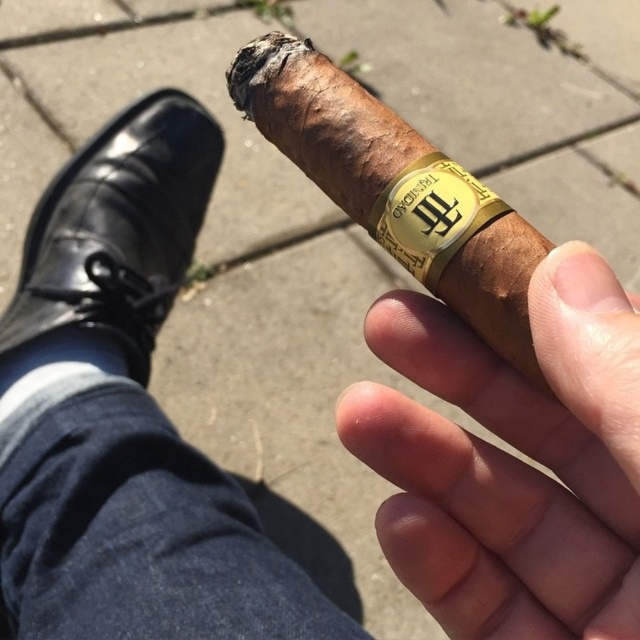
You are a photographer trying to capture the scene with the smooth skin at center and the black leather shoe at lower left. Which object should you focus on first if you want to ensure both are in focus, considering their distances from the camera?

The smooth skin at center is shorter than the black leather shoe at lower left, so you should focus on the black leather shoe at lower left first to ensure both are in focus.

You are a photographer trying to capture the details of the smooth skin at center and the black leather shoe at lower left. Based on their positions, which object is closer to the right side of the image?

The smooth skin at center is to the right of the black leather shoe at lower left, so the smooth skin at center is closer to the right side of the image.